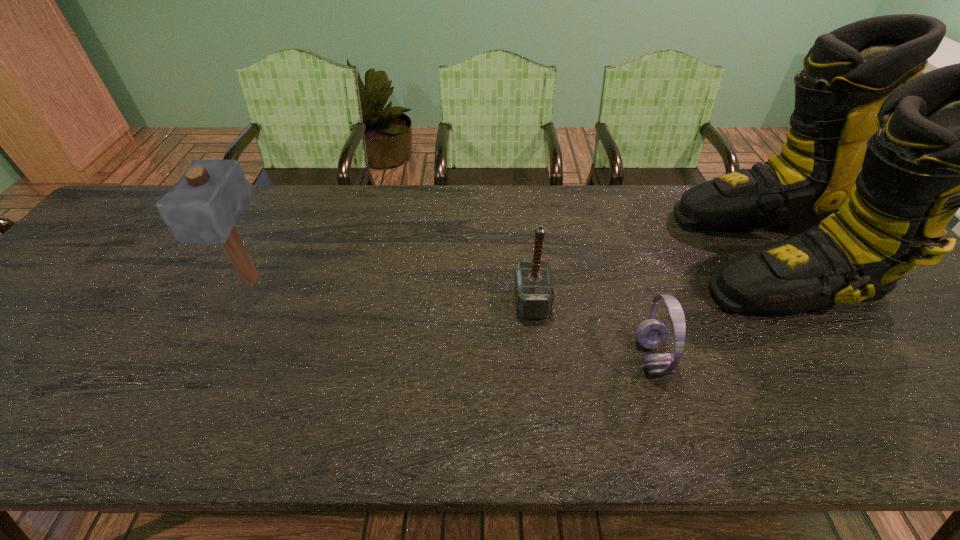
The image size is (960, 540). In order to click on object that ranks as the second closest to the leftmost object in this screenshot , I will do `click(651, 333)`.

Identify which object is the nearest to the headset. Please provide its 2D coordinates. Your answer should be formatted as a tuple, i.e. [(x, y)], where the tuple contains the x and y coordinates of a point satisfying the conditions above.

[(878, 159)]

Where is `vacant position in the image that satisfies the following two spatial constraints: 1. on the back side of the ski boots; 2. on the left side of the leftmost object`? vacant position in the image that satisfies the following two spatial constraints: 1. on the back side of the ski boots; 2. on the left side of the leftmost object is located at coordinates (264, 254).